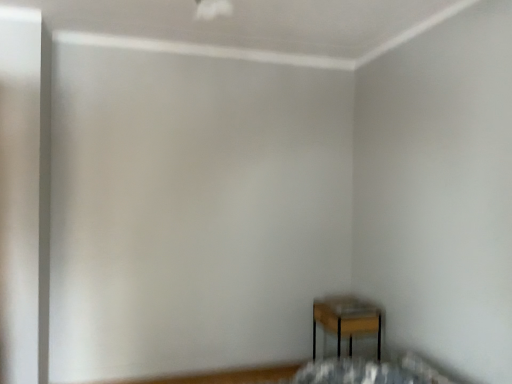
This screenshot has height=384, width=512. What do you see at coordinates (347, 320) in the screenshot?
I see `yellow wood table at lower right` at bounding box center [347, 320].

Identify the location of yellow wood table at lower right. The height and width of the screenshot is (384, 512). (347, 320).

Locate an element on the screen. The image size is (512, 384). yellow wood table at lower right is located at coordinates (347, 320).